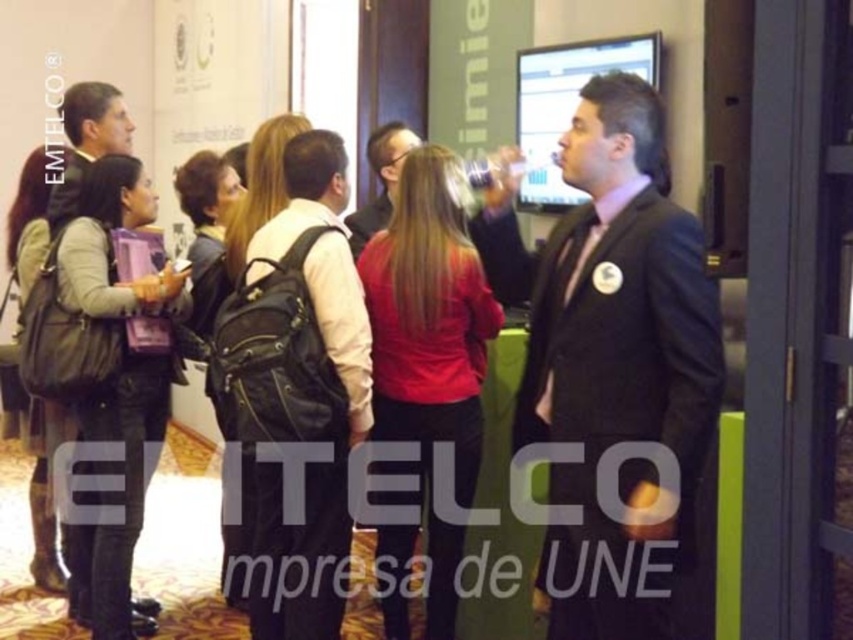
Question: Which point is farther to the camera?

Choices:
 (A) black suit at center
 (B) red matte jacket at center

Answer: (B)

Question: In this image, where is black suit at center located relative to red matte jacket at center?

Choices:
 (A) above
 (B) below

Answer: (A)

Question: Does black suit at center come behind red matte jacket at center?

Choices:
 (A) no
 (B) yes

Answer: (A)

Question: Which point appears farthest from the camera in this image?

Choices:
 (A) (558, 349)
 (B) (451, 330)

Answer: (B)

Question: Is black suit at center in front of red matte jacket at center?

Choices:
 (A) yes
 (B) no

Answer: (A)